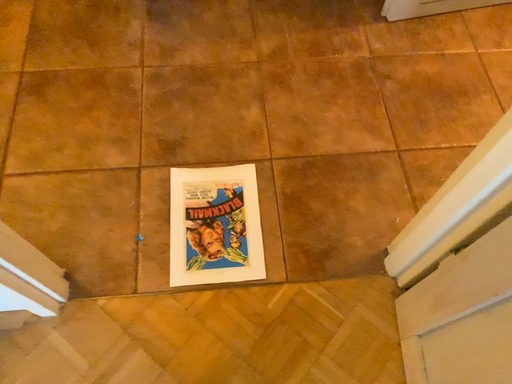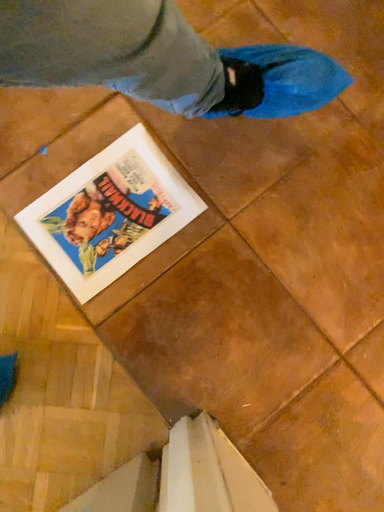
Question: How did the camera likely rotate when shooting the video?

Choices:
 (A) rotated upward
 (B) rotated downward

Answer: (B)